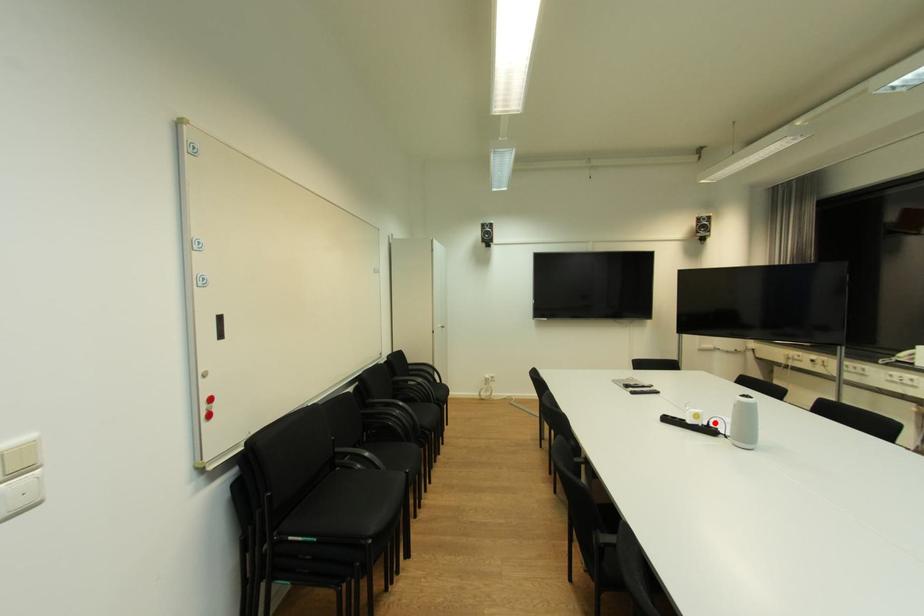
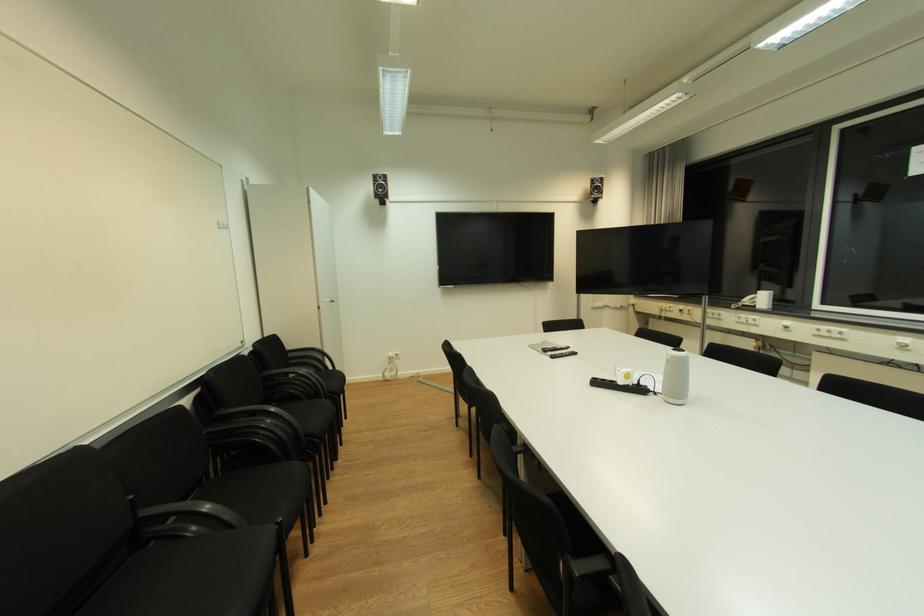
Where in the second image is the point corresponding to the highlighted location from the first image?

(645, 381)